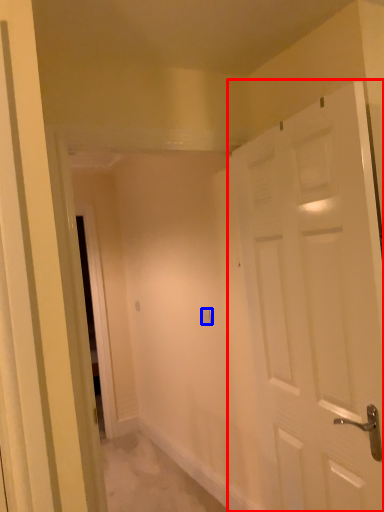
Question: Which point is closer to the camera, door (highlighted by a red box) or electric outlet (highlighted by a blue box)?

Choices:
 (A) door
 (B) electric outlet

Answer: (A)